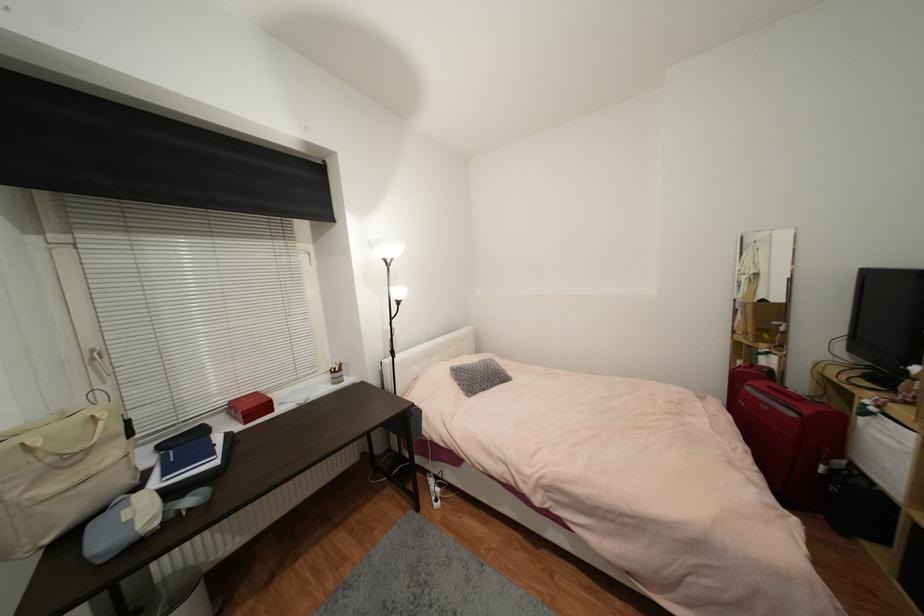
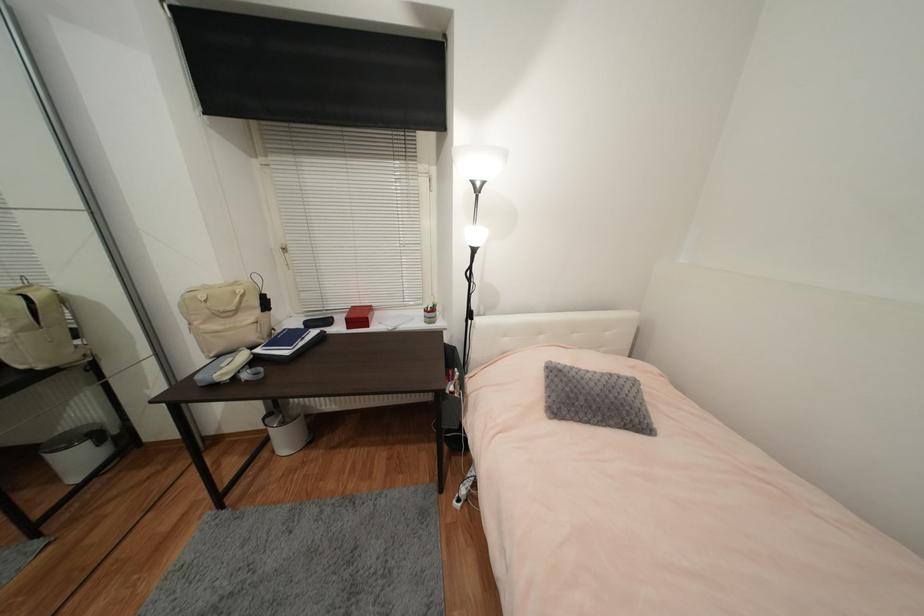
In the second image, find the point that corresponds to [487,371] in the first image.

(602, 391)